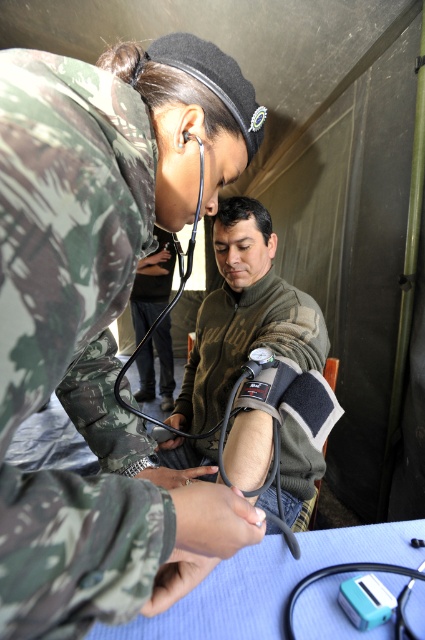
Which is behind, point (68, 576) or point (226, 268)?

The point (226, 268) is behind.

Who is positioned more to the right, camo uniform at center or camouflage fabric blood pressure cuff at center?

camouflage fabric blood pressure cuff at center

Does point (136, 593) come in front of point (209, 458)?

Yes, point (136, 593) is closer to viewer.

The width and height of the screenshot is (425, 640). In order to click on camo uniform at center in this screenshot , I will do `click(95, 324)`.

Between camo uniform at center and teal plastic stethoscope at lower center, which one appears on the left side from the viewer's perspective?

camo uniform at center

Can you confirm if camo uniform at center is positioned below teal plastic stethoscope at lower center?

No, camo uniform at center is not below teal plastic stethoscope at lower center.

Describe the element at coordinates (95, 324) in the screenshot. I see `camo uniform at center` at that location.

This screenshot has height=640, width=425. What are the coordinates of `camo uniform at center` in the screenshot? It's located at (95, 324).

Which is in front, point (156, 58) or point (172, 369)?

Point (156, 58) is in front.

Who is positioned more to the left, camo uniform at center or camouflage fabric uniform at center?

camouflage fabric uniform at center

Is point (198, 113) in front of point (156, 314)?

Yes, point (198, 113) is closer to viewer.

You are a GUI agent. You are given a task and a screenshot of the screen. Output one action in this format:
    pyautogui.click(x=<x>, y=<y>)
    Task: Click on the camo uniform at center
    This screenshot has width=425, height=640.
    Given the screenshot: What is the action you would take?
    pyautogui.click(x=95, y=324)